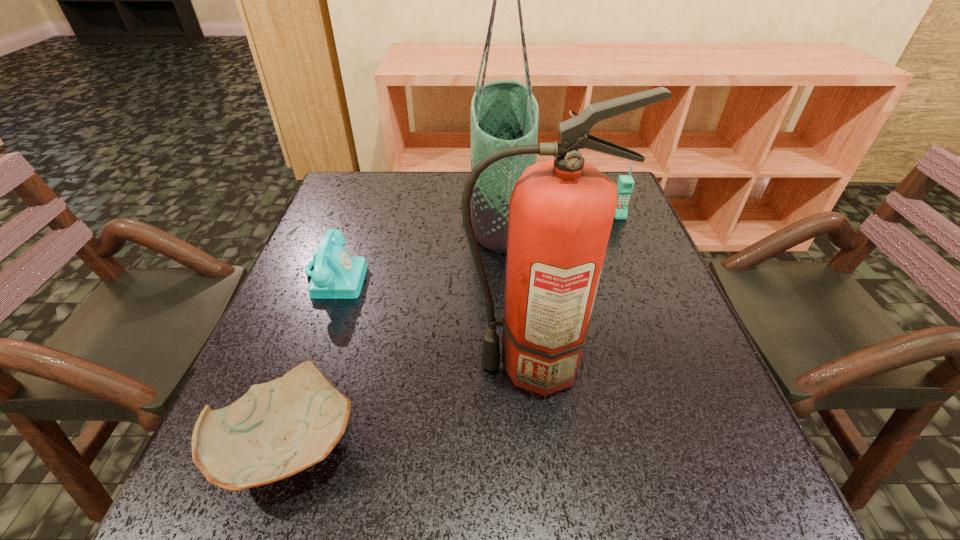
Locate an element on the screen. The image size is (960, 540). vacant space located on the keypad of the cellular telephone is located at coordinates (645, 278).

Identify the location of vacant region located 0.300m on the dial of the telephone. [x=497, y=276].

The height and width of the screenshot is (540, 960). I want to click on vacant region located on the right of the pottery, so click(x=597, y=443).

At what (x,y) coordinates should I click in order to perform the action: click on tote bag located at the far edge. Please return your answer as a coordinate pair (x, y). The image size is (960, 540). Looking at the image, I should click on (504, 113).

Identify the location of cellular telephone that is at the far edge. The width and height of the screenshot is (960, 540). (625, 184).

Find the location of a particular element. object that is at the near edge is located at coordinates (277, 429).

Find the location of a particular element. The width and height of the screenshot is (960, 540). telephone that is positioned at the left edge is located at coordinates (336, 275).

Locate an element on the screen. The height and width of the screenshot is (540, 960). pottery that is at the left edge is located at coordinates (277, 429).

Identify the location of object at the right edge. (625, 184).

This screenshot has width=960, height=540. What are the coordinates of `object located at the near left corner` in the screenshot? It's located at (277, 429).